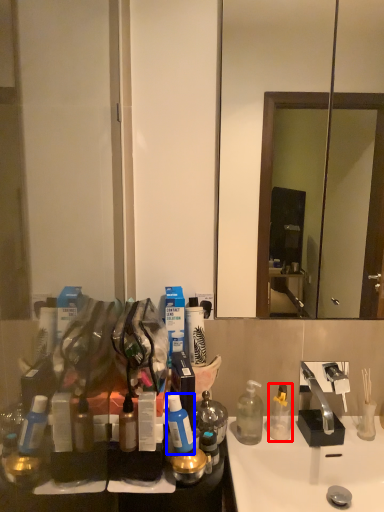
Question: Which object appears closest to the camera in this image, bottle (highlighted by a red box) or bottle (highlighted by a blue box)?

Choices:
 (A) bottle
 (B) bottle

Answer: (B)